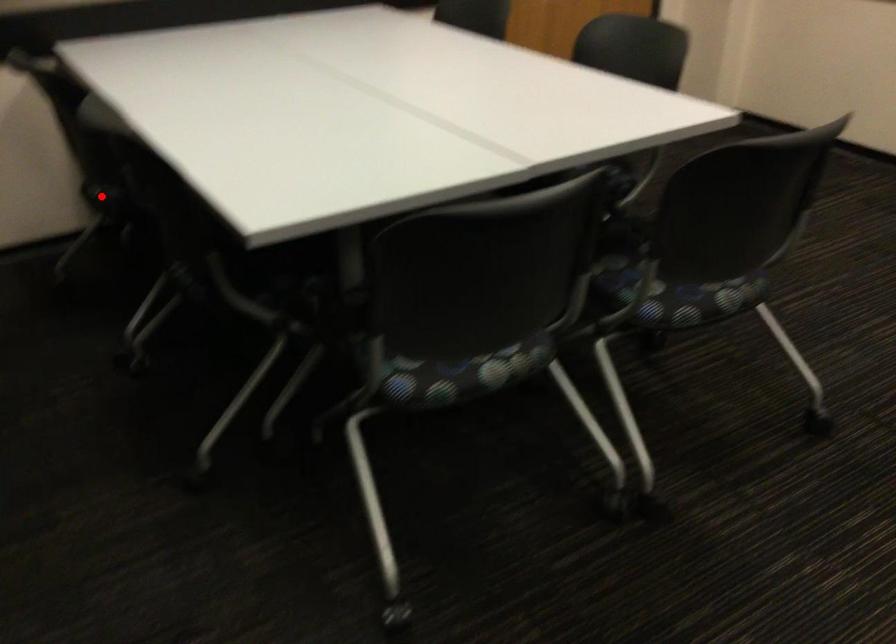
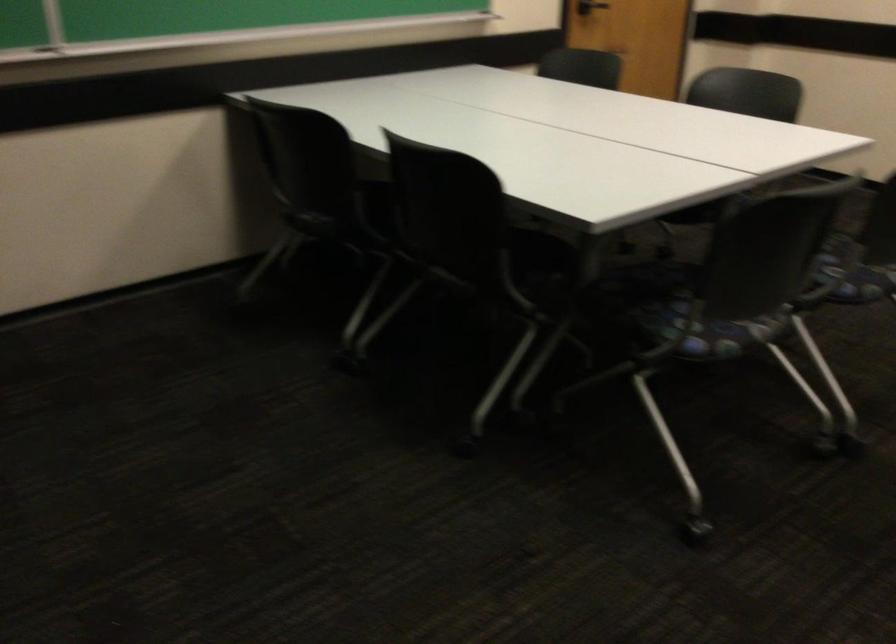
Question: I am providing you with two images of the same scene from different viewpoints. In image1, a red point is highlighted. Considering the same 3D point in image2, which of the following is correct?

Choices:
 (A) It is closer
 (B) It is farther

Answer: (B)